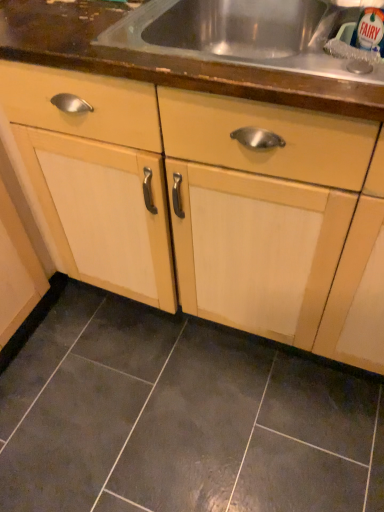
Question: Can you confirm if dark gray ceramic tile at lower center is bigger than wooden countertop at upper center?

Choices:
 (A) no
 (B) yes

Answer: (A)

Question: Does dark gray ceramic tile at lower center turn towards wooden countertop at upper center?

Choices:
 (A) no
 (B) yes

Answer: (A)

Question: From a real-world perspective, is dark gray ceramic tile at lower center under wooden countertop at upper center?

Choices:
 (A) no
 (B) yes

Answer: (B)

Question: From the image's perspective, is dark gray ceramic tile at lower center beneath wooden countertop at upper center?

Choices:
 (A) no
 (B) yes

Answer: (B)

Question: Is dark gray ceramic tile at lower center to the left of wooden countertop at upper center from the viewer's perspective?

Choices:
 (A) yes
 (B) no

Answer: (A)

Question: Relative to light wood cabinet at center, is dark gray ceramic tile at lower center in front or behind?

Choices:
 (A) front
 (B) behind

Answer: (B)

Question: From the image's perspective, is dark gray ceramic tile at lower center located above or below light wood cabinet at center?

Choices:
 (A) below
 (B) above

Answer: (A)

Question: From a real-world perspective, is dark gray ceramic tile at lower center physically located above or below light wood cabinet at center?

Choices:
 (A) above
 (B) below

Answer: (B)

Question: In terms of width, does dark gray ceramic tile at lower center look wider or thinner when compared to light wood cabinet at center?

Choices:
 (A) thin
 (B) wide

Answer: (B)

Question: Is light wood cabinet at center bigger or smaller than dark gray ceramic tile at lower center?

Choices:
 (A) big
 (B) small

Answer: (A)

Question: Which is correct: light wood cabinet at center is inside dark gray ceramic tile at lower center, or outside of it?

Choices:
 (A) outside
 (B) inside

Answer: (A)

Question: Would you say light wood cabinet at center is to the left or to the right of dark gray ceramic tile at lower center in the picture?

Choices:
 (A) right
 (B) left

Answer: (B)

Question: Is point (311, 238) closer or farther from the camera than point (109, 497)?

Choices:
 (A) farther
 (B) closer

Answer: (B)

Question: Is dark gray ceramic tile at lower center inside or outside of wooden countertop at upper center?

Choices:
 (A) outside
 (B) inside

Answer: (A)

Question: Considering the positions of dark gray ceramic tile at lower center and wooden countertop at upper center in the image, is dark gray ceramic tile at lower center bigger or smaller than wooden countertop at upper center?

Choices:
 (A) big
 (B) small

Answer: (B)